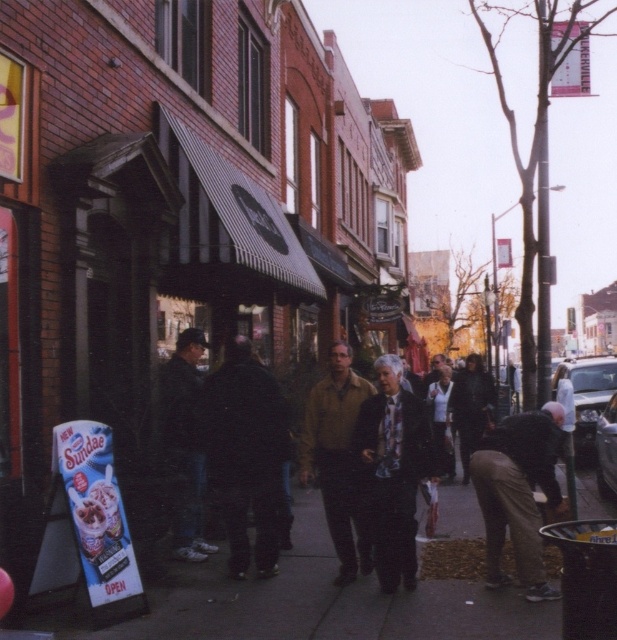
Question: Does black matte jacket at center have a greater width compared to brown cotton pants at lower right?

Choices:
 (A) no
 (B) yes

Answer: (A)

Question: Which of the following is the closest to the observer?

Choices:
 (A) (442, 388)
 (B) (523, 636)

Answer: (B)

Question: Which object appears farthest from the camera in this image?

Choices:
 (A) dark blue jeans at center
 (B) white shirt at center
 (C) dark brown leather jacket at center

Answer: (B)

Question: Among these objects, which one is farthest from the camera?

Choices:
 (A) smooth concrete sidewalk at center
 (B) white shirt at center
 (C) brown cotton pants at lower right
 (D) black matte jacket at center

Answer: (B)

Question: Where is black matte jacket at center located in relation to dark gray suit at center in the image?

Choices:
 (A) below
 (B) above

Answer: (B)

Question: Can you confirm if brown cotton pants at lower right is positioned below dark brown leather jacket at center?

Choices:
 (A) yes
 (B) no

Answer: (B)